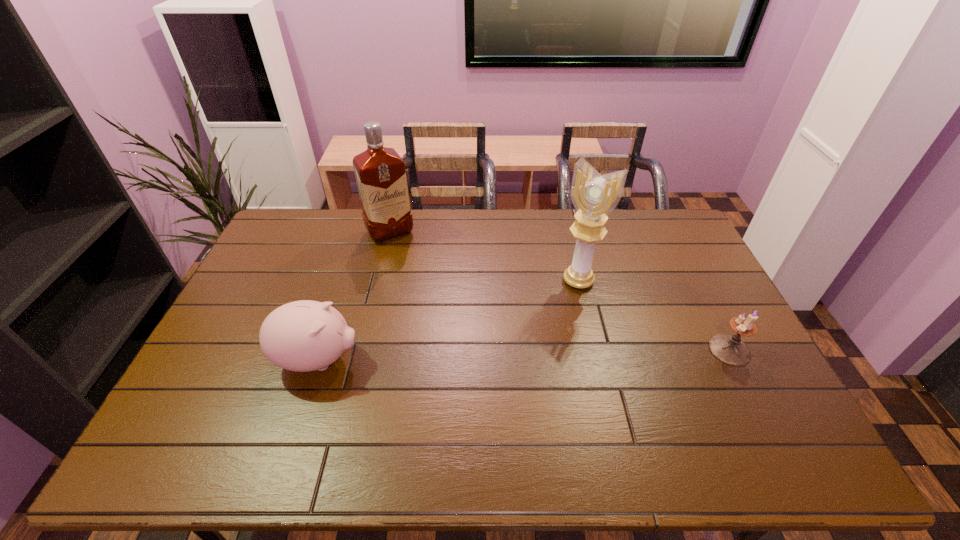
You are a GUI agent. You are given a task and a screenshot of the screen. Output one action in this format:
    pyautogui.click(x=<x>, y=<y>)
    Task: Click on the vacant point located between the farthest object and the third object from left to right
    The width and height of the screenshot is (960, 540).
    Given the screenshot: What is the action you would take?
    pyautogui.click(x=484, y=256)

Where is `vacant space in between the piggy bank and the candle holder`? This screenshot has height=540, width=960. vacant space in between the piggy bank and the candle holder is located at coordinates (524, 355).

This screenshot has height=540, width=960. I want to click on unoccupied area between the rightmost object and the piggy bank, so click(524, 355).

I want to click on free area in between the piggy bank and the third nearest object, so click(x=448, y=320).

The image size is (960, 540). I want to click on vacant region between the piggy bank and the third nearest object, so click(x=448, y=320).

The width and height of the screenshot is (960, 540). Find the location of `vacant space in between the candle holder and the second farthest object`. vacant space in between the candle holder and the second farthest object is located at coordinates (654, 315).

Locate an element on the screen. vacant area between the third object from left to right and the piggy bank is located at coordinates (448, 320).

Image resolution: width=960 pixels, height=540 pixels. Find the location of `free point between the rightmost object and the liquor`. free point between the rightmost object and the liquor is located at coordinates (560, 291).

At what (x,y) coordinates should I click in order to perform the action: click on vacant space that's between the rightmost object and the piggy bank. Please return your answer as a coordinate pair (x, y). Looking at the image, I should click on (524, 355).

Select which object appears as the closest to the liquor. Please provide its 2D coordinates. Your answer should be formatted as a tuple, i.e. [(x, y)], where the tuple contains the x and y coordinates of a point satisfying the conditions above.

[(302, 336)]